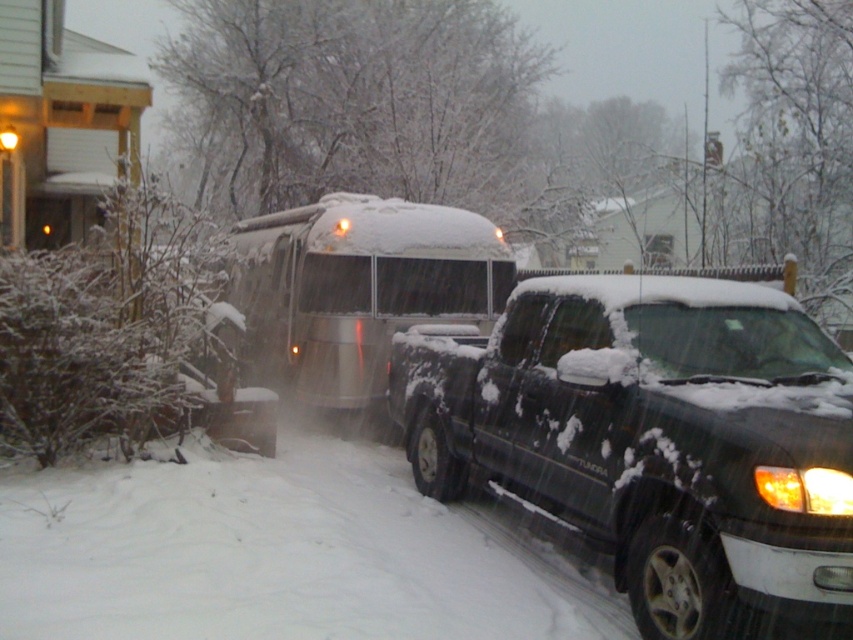
In the scene shown: You are standing 10 feet away from the black matte truck at center. Can you reach the truck without moving closer?

The black matte truck at center is 12.14 feet away from the viewer. Since you are standing 10 feet away, you are still 2.14 feet away from the truck, so you need to move closer to reach it.

You are standing in front of the house and want to walk to the black matte truck at center. Which direction should you walk relative to the silver metallic bus at center?

The black matte truck at center is located below the silver metallic bus at center, so you should walk downward towards the black matte truck at center relative to the silver metallic bus at center.